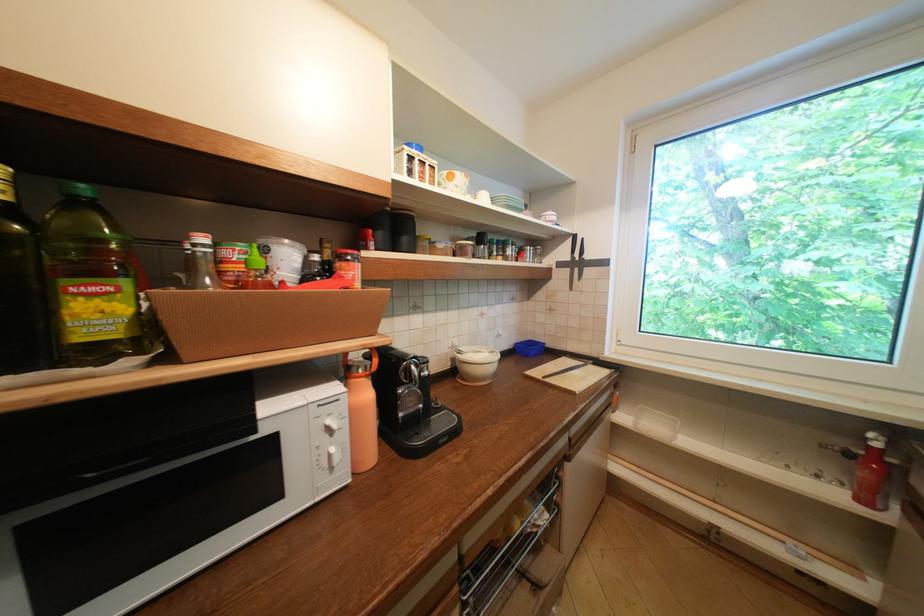
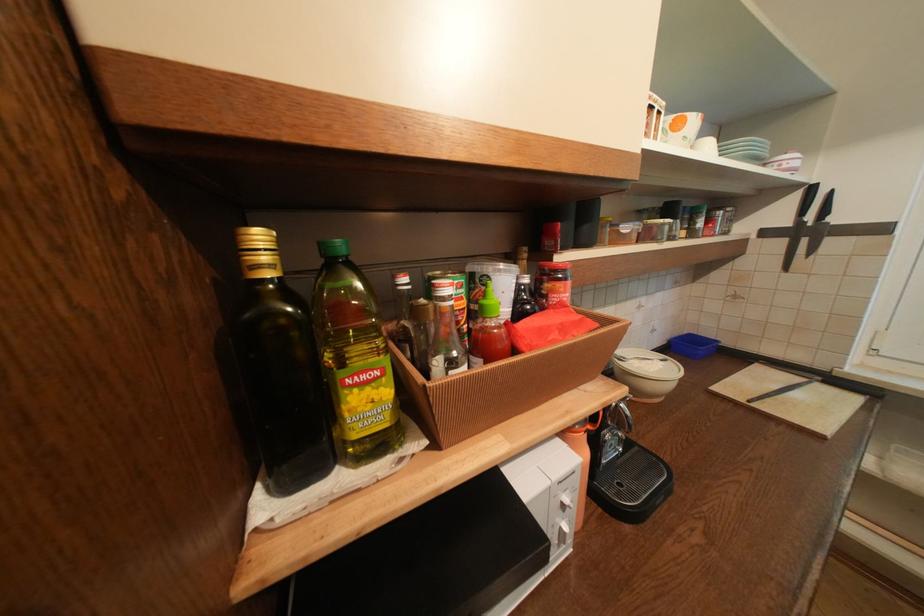
Where in the second image is the point corresponding to (110,291) from the first image?

(379, 377)